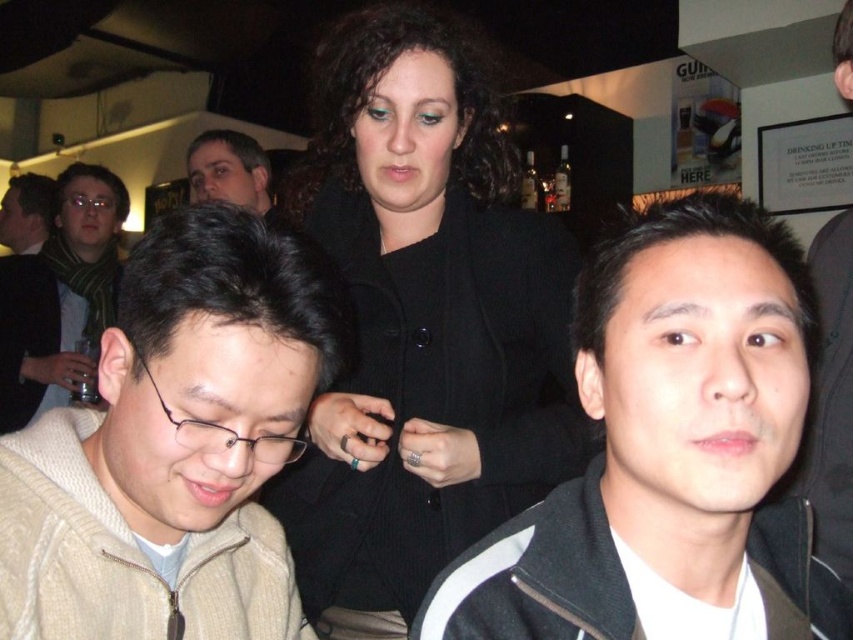
Question: Which object is the closest to the smooth black jacket at center?

Choices:
 (A) black matte jacket at center
 (B) matte black glasses at left

Answer: (A)

Question: Does smooth black jacket at center have a greater width compared to matte black jacket at left?

Choices:
 (A) no
 (B) yes

Answer: (A)

Question: Among these points, which one is farthest from the camera?

Choices:
 (A) click(x=399, y=74)
 (B) click(x=657, y=456)

Answer: (A)

Question: Does black woolen coat at center have a greater width compared to black matte jacket at center?

Choices:
 (A) yes
 (B) no

Answer: (A)

Question: Can you confirm if matte black glasses at left is thinner than matte black jacket at upper center?

Choices:
 (A) yes
 (B) no

Answer: (B)

Question: Which of the following is the closest to the observer?

Choices:
 (A) black matte jacket at center
 (B) smooth black jacket at center
 (C) black woolen coat at center

Answer: (A)